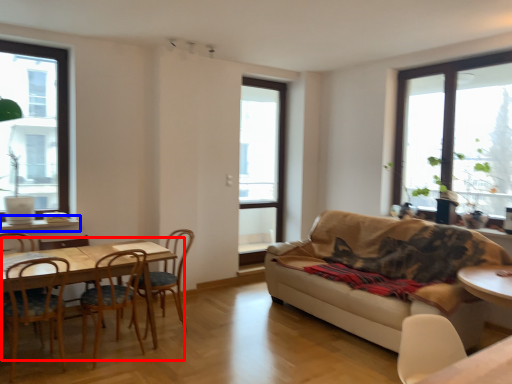
Question: Which of the following is the closest to the observer, kitchen & dining room table (highlighted by a red box) or window sill (highlighted by a blue box)?

Choices:
 (A) kitchen & dining room table
 (B) window sill

Answer: (A)